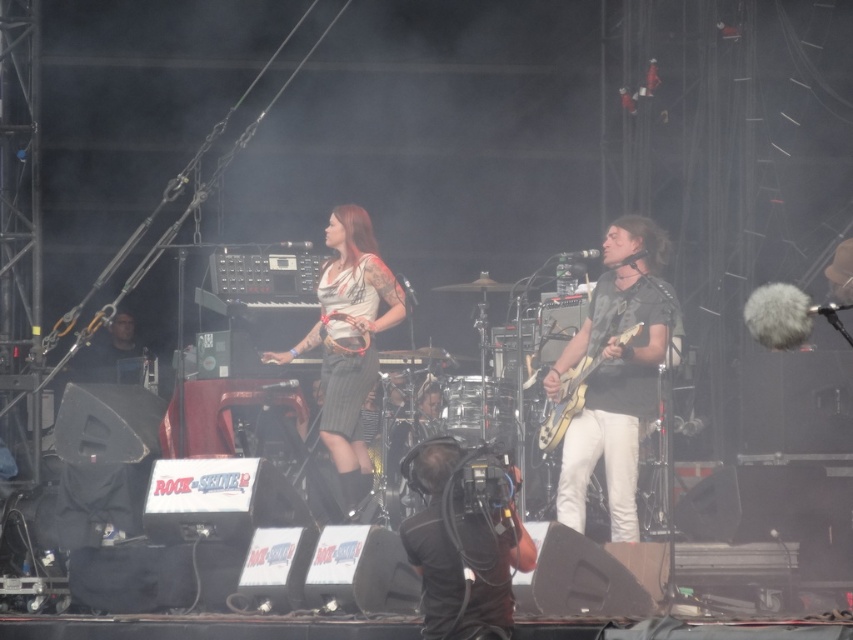
Which of these two, black fabric camera at lower center or shiny metallic guitar at center, stands shorter?

Standing shorter between the two is shiny metallic guitar at center.

Which is more to the right, black fabric camera at lower center or shiny metallic guitar at center?

shiny metallic guitar at center

Which is behind, point (476, 552) or point (573, 410)?

The point (573, 410) is more distant.

Locate an element on the screen. black fabric camera at lower center is located at coordinates (463, 540).

Which is above, black matte guitar at right or black fabric camera at lower center?

black matte guitar at right is above.

Can you confirm if black matte guitar at right is positioned below black fabric camera at lower center?

Incorrect, black matte guitar at right is not positioned below black fabric camera at lower center.

Which is behind, point (660, 236) or point (418, 481)?

The point (660, 236) is more distant.

Where is `black matte guitar at right`? This screenshot has width=853, height=640. black matte guitar at right is located at coordinates (614, 372).

Between black matte guitar at right and shiny metallic guitar at center, which one appears on the right side from the viewer's perspective?

black matte guitar at right is more to the right.

This screenshot has height=640, width=853. Identify the location of black matte guitar at right. (614, 372).

Where is `black matte guitar at right`? black matte guitar at right is located at coordinates click(614, 372).